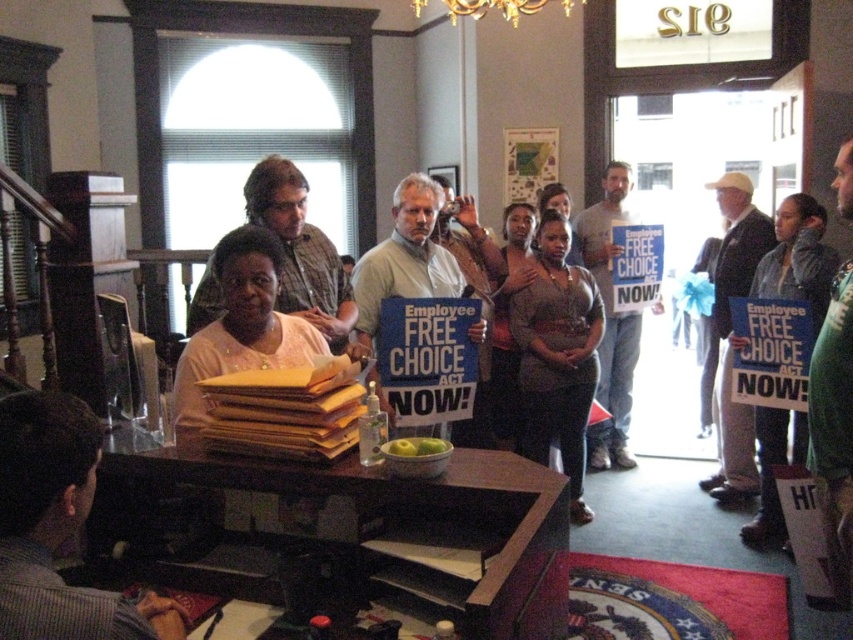
Question: Based on their relative distances, which object is farther from the matte blue sign at center?

Choices:
 (A) light brown suit at center
 (B) dark gray striped shirt at lower left
 (C) matte brown shirt at center
 (D) green fabric jacket at center

Answer: (B)

Question: Estimate the real-world distances between objects in this image. Which object is closer to the dark gray striped shirt at lower left?

Choices:
 (A) gray cotton shirt at center
 (B) matte brown shirt at center

Answer: (B)

Question: Which point is farther from the camera taking this photo?

Choices:
 (A) (776, 211)
 (B) (718, 337)
 (C) (345, 340)

Answer: (B)

Question: Does pink fabric shirt at center have a greater width compared to gray cotton shirt at center?

Choices:
 (A) no
 (B) yes

Answer: (B)

Question: Can you confirm if matte brown shirt at center is thinner than light brown suit at center?

Choices:
 (A) no
 (B) yes

Answer: (A)

Question: Can you confirm if light brown suit at center is smaller than matte blue sign at center?

Choices:
 (A) no
 (B) yes

Answer: (B)